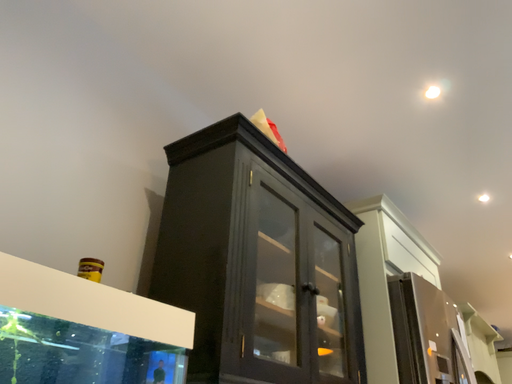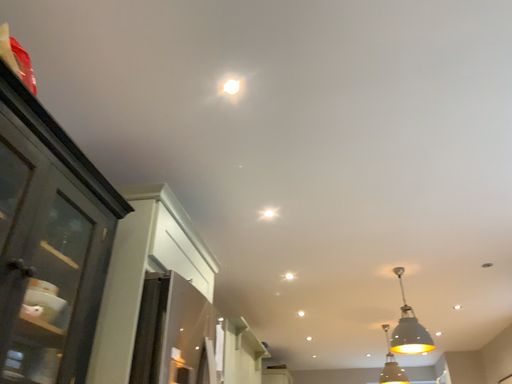
Question: How did the camera likely rotate when shooting the video?

Choices:
 (A) rotated left
 (B) rotated right

Answer: (B)